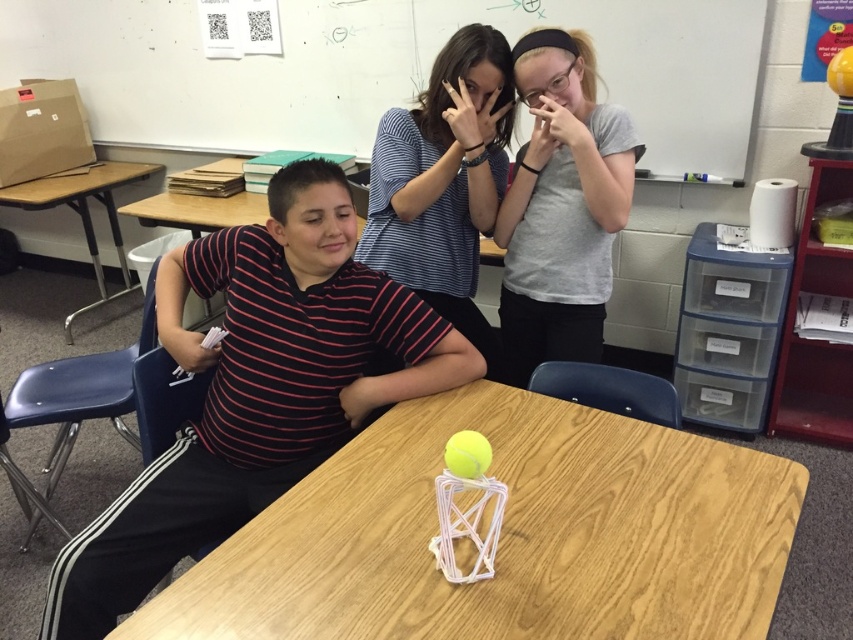
Find the location of a particular element. This screenshot has height=640, width=853. wooden table at center is located at coordinates (505, 536).

Is wooden table at center below brown wood table at left?

Correct, wooden table at center is located below brown wood table at left.

Locate an element on the screen. The image size is (853, 640). wooden table at center is located at coordinates (505, 536).

In order to click on wooden table at center in this screenshot , I will do `click(505, 536)`.

Can you confirm if wooden table at center is smaller than striped cotton shirt at left?

Indeed, wooden table at center has a smaller size compared to striped cotton shirt at left.

Is point (457, 614) in front of point (375, 289)?

Yes, it is in front of point (375, 289).

Does point (314, 586) lie behind point (341, 296)?

No, (314, 586) is closer to viewer.

This screenshot has height=640, width=853. I want to click on wooden table at center, so click(x=505, y=536).

Is striped cotton shirt at left to the left of brown wood table at left from the viewer's perspective?

In fact, striped cotton shirt at left is to the right of brown wood table at left.

Looking at this image, can you confirm if striped cotton shirt at left is positioned above brown wood table at left?

No, striped cotton shirt at left is not above brown wood table at left.

Does point (242, 500) come in front of point (109, 196)?

That is True.

Where is `striped cotton shirt at left`? This screenshot has width=853, height=640. striped cotton shirt at left is located at coordinates (258, 388).